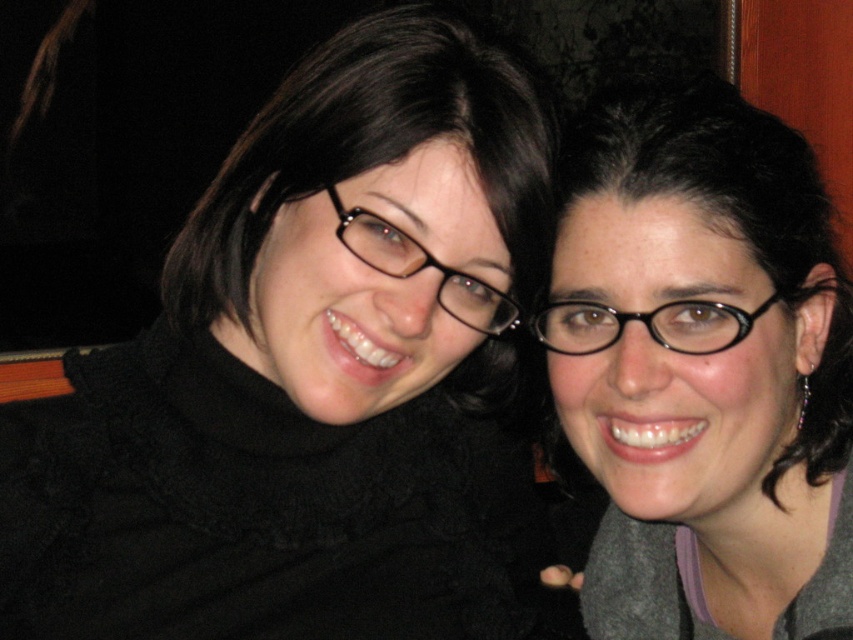
The height and width of the screenshot is (640, 853). What do you see at coordinates (315, 378) in the screenshot?
I see `matte black sweater at upper left` at bounding box center [315, 378].

Does matte black sweater at upper left have a greater height compared to black plastic glasses at right?

Indeed, matte black sweater at upper left has a greater height compared to black plastic glasses at right.

Between point (158, 426) and point (572, 301), which one is positioned behind?

The point (158, 426) is more distant.

Find the location of `matte black sweater at upper left`. matte black sweater at upper left is located at coordinates (315, 378).

Can you confirm if black matte glasses at center is positioned below black plastic glasses at right?

Yes.

Locate an element on the screen. Image resolution: width=853 pixels, height=640 pixels. black matte glasses at center is located at coordinates (703, 369).

Describe the element at coordinates (315, 378) in the screenshot. I see `matte black sweater at upper left` at that location.

Where is `matte black sweater at upper left`? The image size is (853, 640). matte black sweater at upper left is located at coordinates (315, 378).

You are a GUI agent. You are given a task and a screenshot of the screen. Output one action in this format:
    pyautogui.click(x=<x>, y=<y>)
    Task: Click on the matte black sweater at upper left
    The width and height of the screenshot is (853, 640).
    Given the screenshot: What is the action you would take?
    pyautogui.click(x=315, y=378)